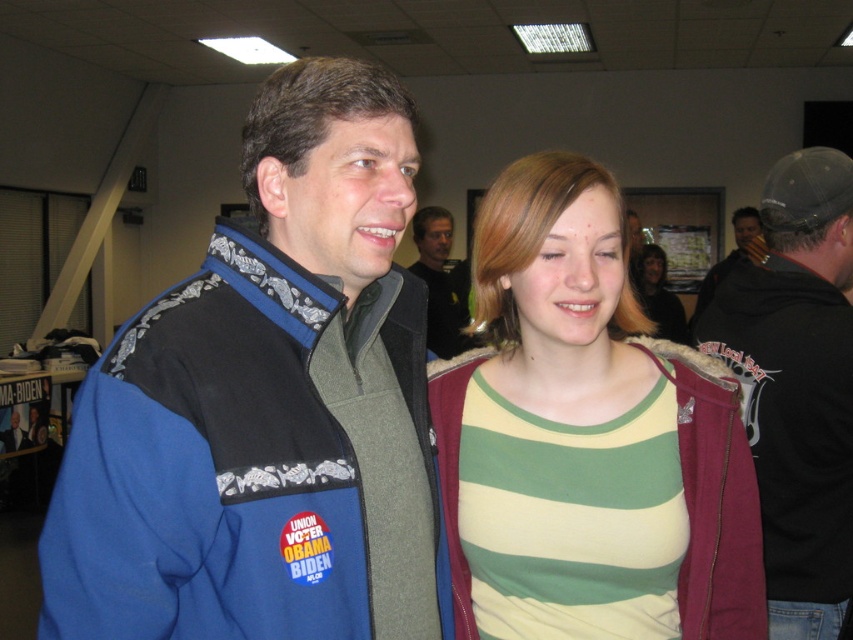
At what (x,y) coordinates should I click in order to perform the action: click on striped cotton shirt at center. Please return your answer as a coordinate pair (x, y). Looking at the image, I should click on (596, 392).

Is point (477, 285) more distant than point (746, 227)?

No, it is in front of (746, 227).

At what (x,y) coordinates should I click in order to perform the action: click on striped cotton shirt at center. Please return your answer as a coordinate pair (x, y). Looking at the image, I should click on (596, 392).

From the picture: Does blue fleece jacket at center have a larger size compared to dark gray textured jacket at right?

Incorrect, blue fleece jacket at center is not larger than dark gray textured jacket at right.

Is blue fleece jacket at center to the left of dark gray textured jacket at right from the viewer's perspective?

Correct, you'll find blue fleece jacket at center to the left of dark gray textured jacket at right.

Locate an element on the screen. blue fleece jacket at center is located at coordinates (267, 406).

Does striped cotton shirt at center appear under dark blue fleece jacket at center?

Correct, striped cotton shirt at center is located below dark blue fleece jacket at center.

Is the position of striped cotton shirt at center less distant than that of dark blue fleece jacket at center?

Yes, it is in front of dark blue fleece jacket at center.

Locate an element on the screen. The height and width of the screenshot is (640, 853). striped cotton shirt at center is located at coordinates (596, 392).